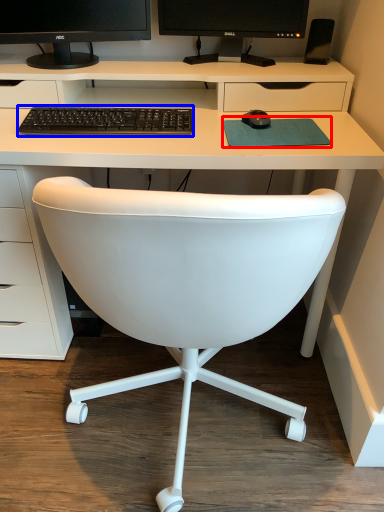
Question: Which of the following is the closest to the observer, mousepad (highlighted by a red box) or computer keyboard (highlighted by a blue box)?

Choices:
 (A) mousepad
 (B) computer keyboard

Answer: (A)